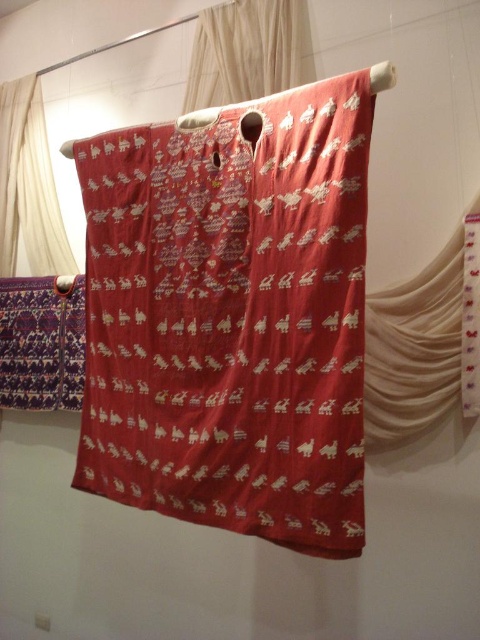
Can you confirm if silky white curtain at upper center is wider than silky white curtain at left?

Correct, the width of silky white curtain at upper center exceeds that of silky white curtain at left.

Can you confirm if silky white curtain at upper center is positioned below silky white curtain at left?

Incorrect, silky white curtain at upper center is not positioned below silky white curtain at left.

Locate an element on the screen. The height and width of the screenshot is (640, 480). silky white curtain at upper center is located at coordinates (248, 51).

Does silky red fabric at center appear over silky white curtain at left?

Actually, silky red fabric at center is below silky white curtain at left.

Which of these two, silky red fabric at center or silky white curtain at left, stands taller?

With more height is silky red fabric at center.

This screenshot has width=480, height=640. Identify the location of silky red fabric at center. (231, 317).

Does matte white curtain at right lie in front of silky white curtain at left?

Yes, matte white curtain at right is closer to the viewer.

At what (x,y) coordinates should I click in order to perform the action: click on matte white curtain at right. Please return your answer as a coordinate pair (x, y). This screenshot has height=640, width=480. Looking at the image, I should click on (414, 348).